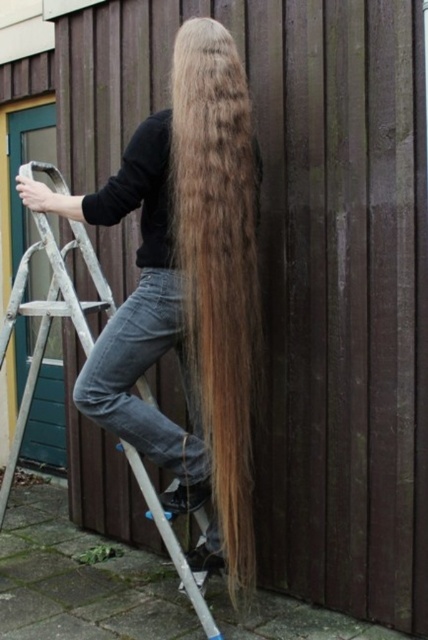
Question: Considering the relative positions of golden brown silky hair at center and metallic silver ladder at center in the image provided, where is golden brown silky hair at center located with respect to metallic silver ladder at center?

Choices:
 (A) right
 (B) left

Answer: (A)

Question: Which of the following is the closest to the observer?

Choices:
 (A) metallic silver ladder at center
 (B) golden brown silky hair at center

Answer: (B)

Question: Which of the following is the farthest from the observer?

Choices:
 (A) golden brown silky hair at center
 (B) metallic silver ladder at center

Answer: (B)

Question: Is golden brown silky hair at center in front of metallic silver ladder at center?

Choices:
 (A) yes
 (B) no

Answer: (A)

Question: Is golden brown silky hair at center further to the viewer compared to metallic silver ladder at center?

Choices:
 (A) yes
 (B) no

Answer: (B)